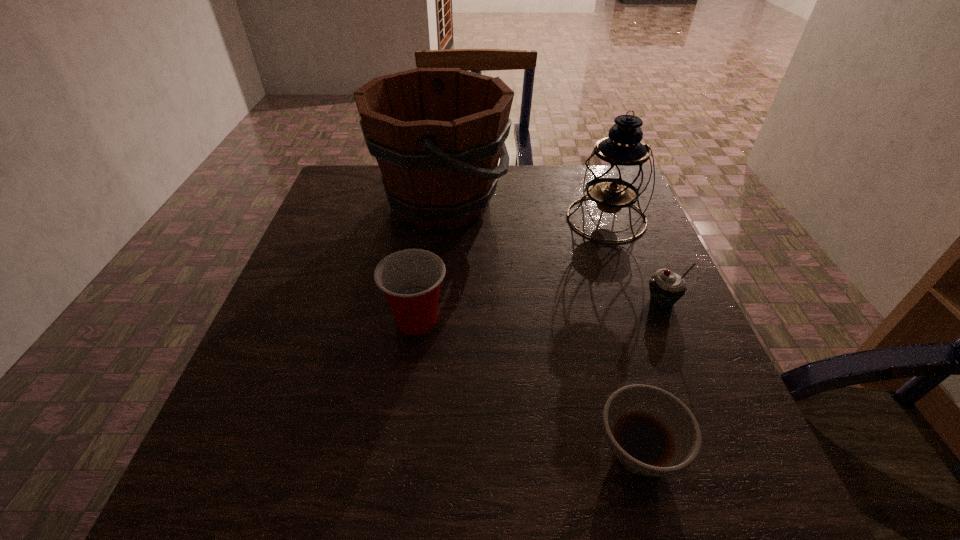
Where is `free point between the third shortest object and the shortest object`? free point between the third shortest object and the shortest object is located at coordinates (528, 386).

Locate an element on the screen. Image resolution: width=960 pixels, height=540 pixels. blank region between the bucket and the lantern is located at coordinates point(524,211).

At what (x,y) coordinates should I click in order to perform the action: click on empty space between the third shortest object and the shortest object. Please return your answer as a coordinate pair (x, y). Image resolution: width=960 pixels, height=540 pixels. Looking at the image, I should click on (528, 386).

I want to click on empty space that is in between the bucket and the cupcake, so click(551, 252).

Where is `vacant space that's between the nearest object and the second shortest object`? vacant space that's between the nearest object and the second shortest object is located at coordinates (650, 376).

Where is `free spot between the lantern and the third shortest object`? This screenshot has width=960, height=540. free spot between the lantern and the third shortest object is located at coordinates (512, 269).

Where is `blank region between the nearest object and the cup`? The height and width of the screenshot is (540, 960). blank region between the nearest object and the cup is located at coordinates (528, 386).

You are a GUI agent. You are given a task and a screenshot of the screen. Output one action in this format:
    pyautogui.click(x=<x>, y=<y>)
    Task: Click on the free space between the shortest object and the cup
    This screenshot has height=540, width=960.
    Given the screenshot: What is the action you would take?
    pyautogui.click(x=528, y=386)

Identify which object is the fourth closest to the third tallest object. Please provide its 2D coordinates. Your answer should be formatted as a tuple, i.e. [(x, y)], where the tuple contains the x and y coordinates of a point satisfying the conditions above.

[(666, 288)]

Choose which object is the nearest neighbor to the third shortest object. Please provide its 2D coordinates. Your answer should be formatted as a tuple, i.e. [(x, y)], where the tuple contains the x and y coordinates of a point satisfying the conditions above.

[(437, 134)]